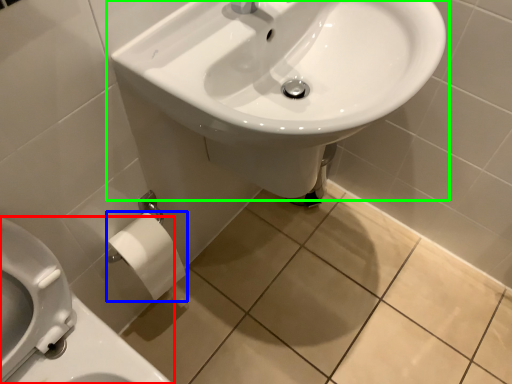
Question: Which object is the farthest from toilet (highlighted by a red box)? Choose among these: toilet paper (highlighted by a blue box) or sink (highlighted by a green box).

Choices:
 (A) toilet paper
 (B) sink

Answer: (B)